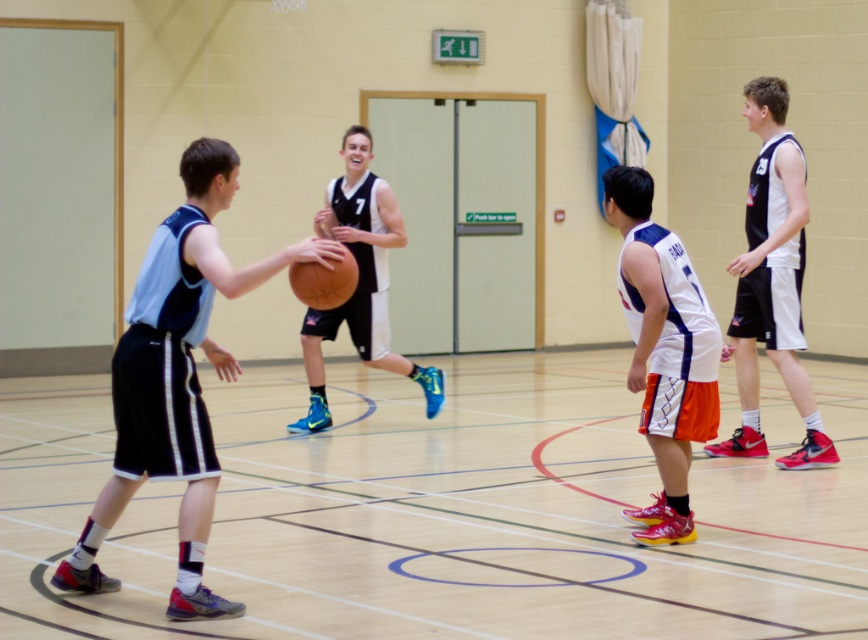
You are a spectator standing at the entrance of the gymnasium. You see the white matte jersey at center and the green exit sign above the door. Which object is closer to the entrance based on their positions?

The white matte jersey at center is closer to the entrance than the green exit sign above the door because its coordinates are closer to the entrance point.

You are a referee observing the basketball game. You notice the white matte jersey at center and the matte black basketball at center. Which object is wider?

The matte black basketball at center is wider than the white matte jersey at center.

You are a referee standing at the edge of the basketball court. You need to determine if the player in the white matte jersey at center can reach the rubber textured basketball at center without moving. Based on their positions, can they reach it?

The white matte jersey at center is further to the viewer than the rubber textured basketball at center, meaning the player is closer to the basketball. Therefore, the player in the white matte jersey at center can likely reach the rubber textured basketball at center without moving.